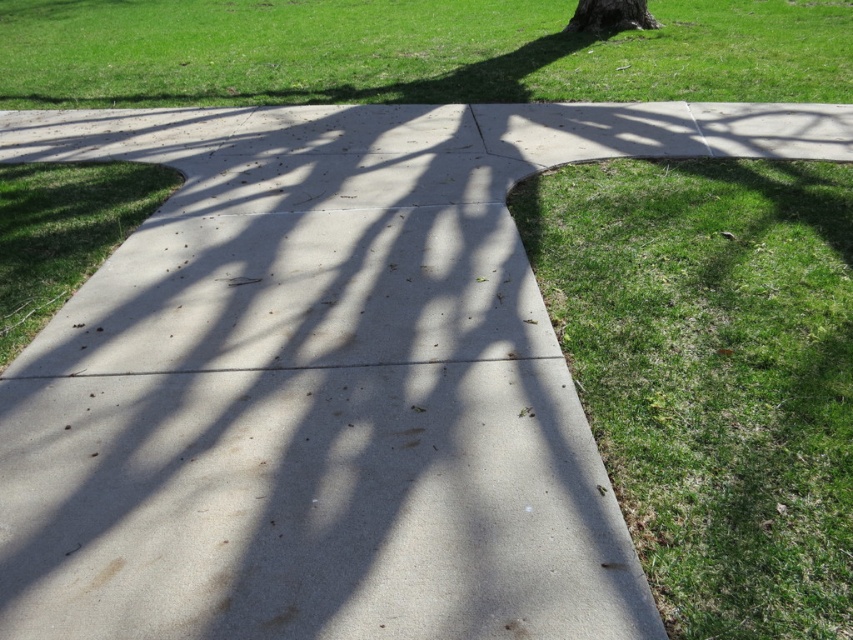
Question: Which object appears farthest from the camera in this image?

Choices:
 (A) green grass at upper center
 (B) green rough bark tree at upper center
 (C) green grass at lower right

Answer: (B)

Question: Does green grass at lower right appear on the left side of green grass at upper center?

Choices:
 (A) yes
 (B) no

Answer: (B)

Question: Can you confirm if green grass at lower right is positioned to the right of green rough bark tree at upper center?

Choices:
 (A) no
 (B) yes

Answer: (A)

Question: Which of the following is the closest to the observer?

Choices:
 (A) green grass at upper center
 (B) green grass at lower right

Answer: (B)

Question: Among these points, which one is farthest from the camera?

Choices:
 (A) (646, 541)
 (B) (16, 67)

Answer: (B)

Question: Is the position of green grass at lower right more distant than that of green grass at upper center?

Choices:
 (A) no
 (B) yes

Answer: (A)